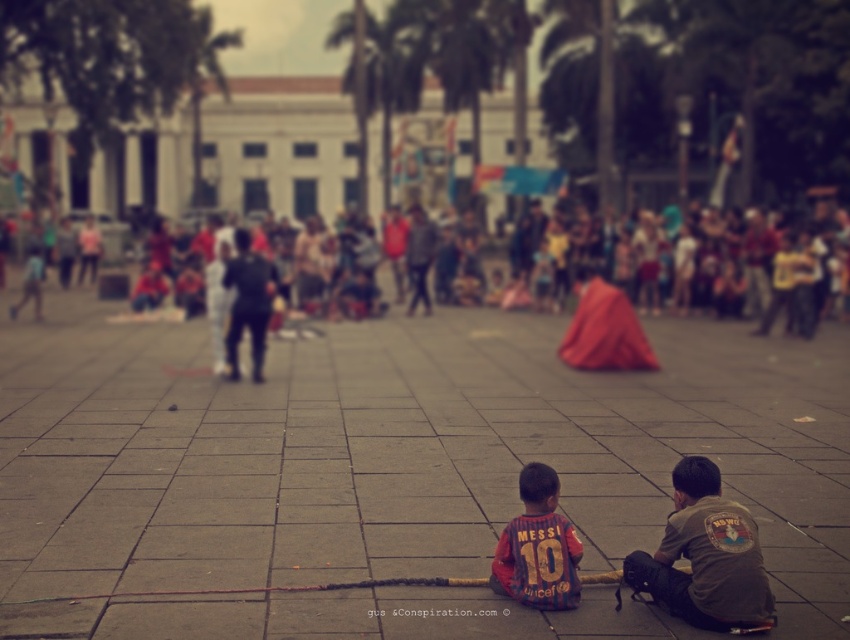
Question: Does blurred people at center appear over brown cotton shirt at lower right?

Choices:
 (A) no
 (B) yes

Answer: (B)

Question: Which of the following is the farthest from the observer?

Choices:
 (A) (751, 538)
 (B) (809, 256)

Answer: (B)

Question: Considering the real-world distances, which object is farthest from the gray concrete pavement at center?

Choices:
 (A) brown cotton shirt at lower right
 (B) blurred people at center

Answer: (B)

Question: Is brown cotton shirt at lower right thinner than jersey at lower center?

Choices:
 (A) no
 (B) yes

Answer: (A)

Question: Which of the following is the farthest from the observer?

Choices:
 (A) (578, 276)
 (B) (520, 577)
 (C) (632, 563)

Answer: (A)

Question: Can you confirm if blurred people at center is smaller than jersey at lower center?

Choices:
 (A) yes
 (B) no

Answer: (B)